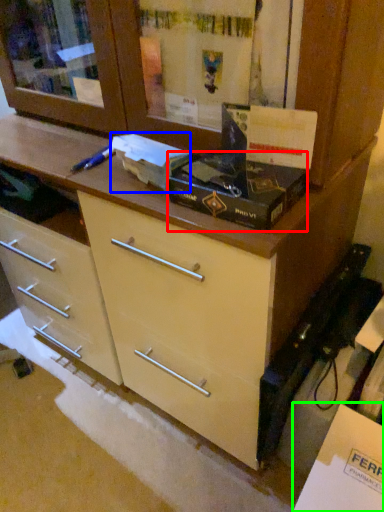
Question: Which object is positioned farthest from box (highlighted by a red box)? Select from box (highlighted by a blue box) and cabinetry (highlighted by a green box).

Choices:
 (A) box
 (B) cabinetry

Answer: (B)